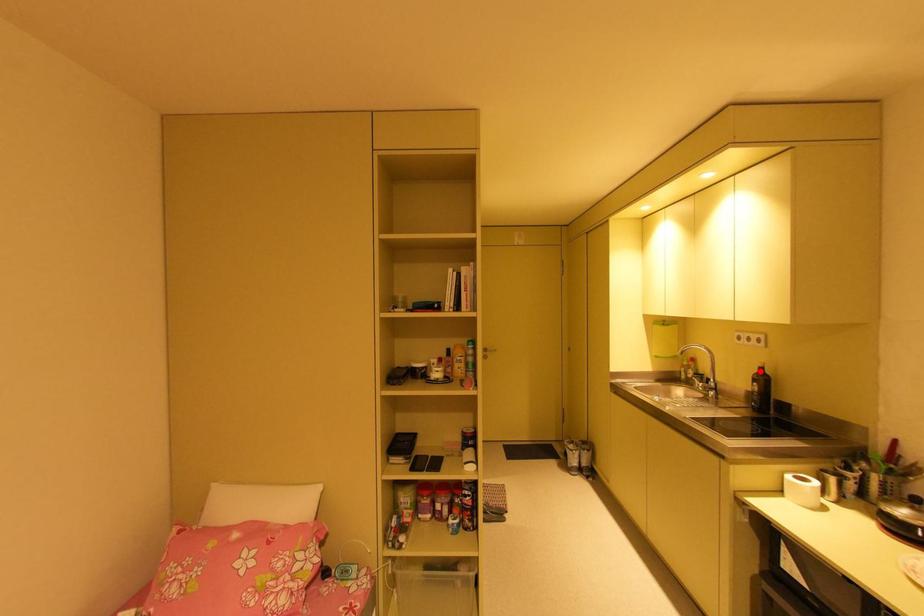
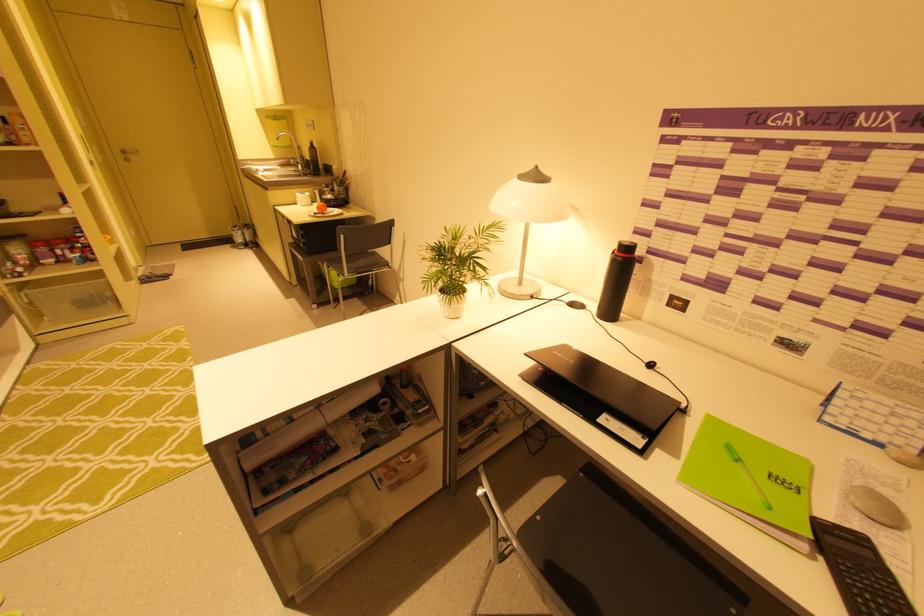
Where in the second image is the point corresponding to the highlighted location from the first image?

(313, 146)